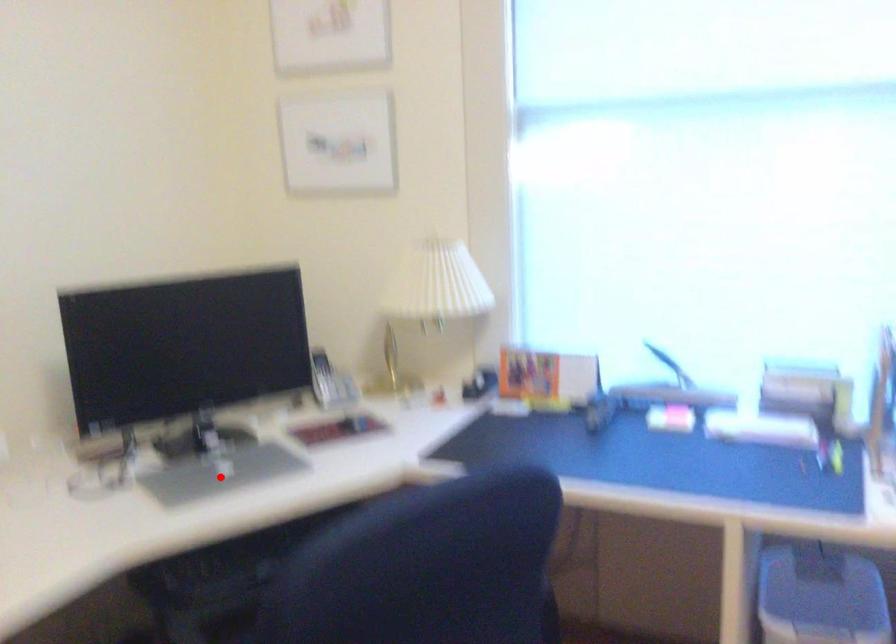
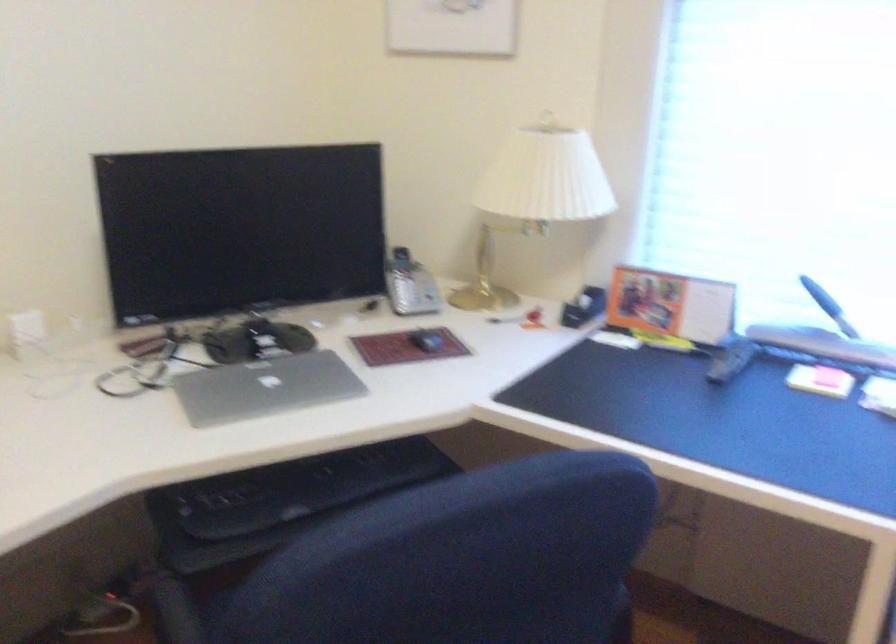
Question: I am providing you with two images of the same scene from different viewpoints. Image1 has a red point marked. In image2, the corresponding 3D location appears at what relative position? Reply with the corresponding letter.

Choices:
 (A) Closer
 (B) Farther

Answer: (A)